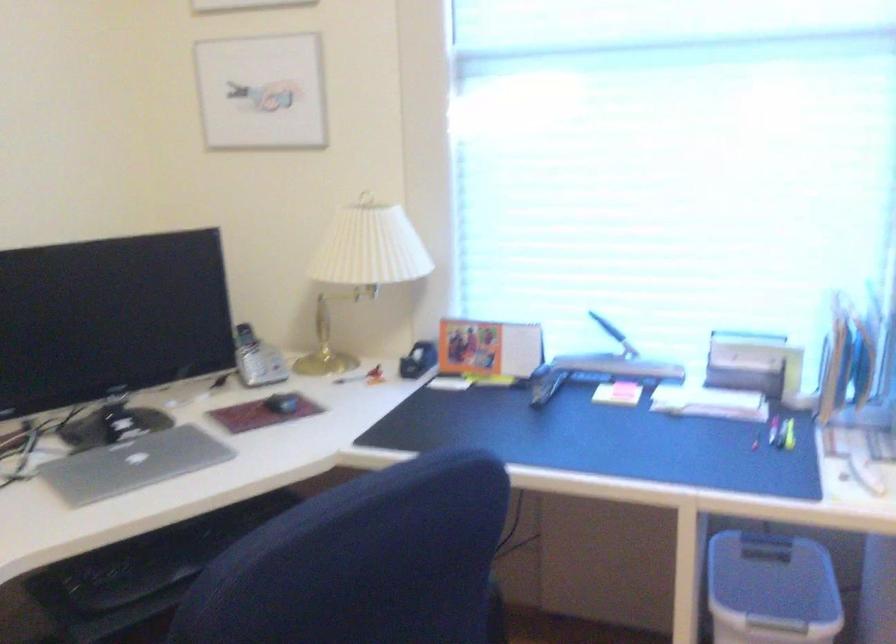
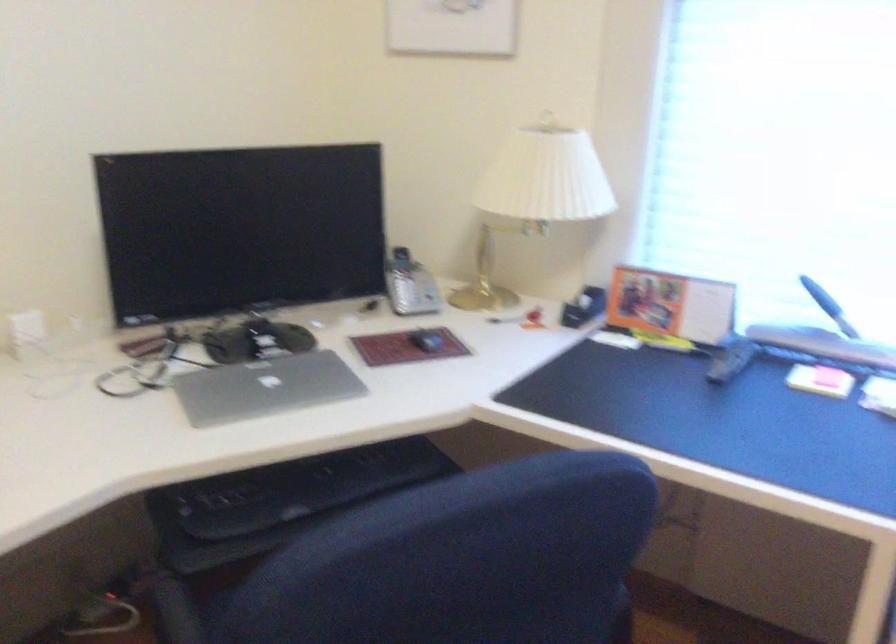
Where in the second image is the point corresponding to point (281, 404) from the first image?

(426, 341)